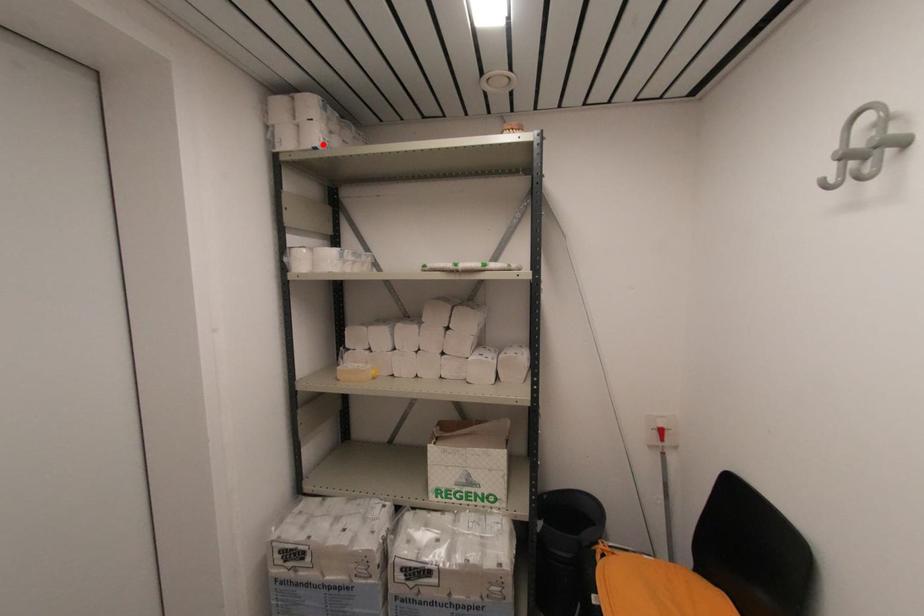
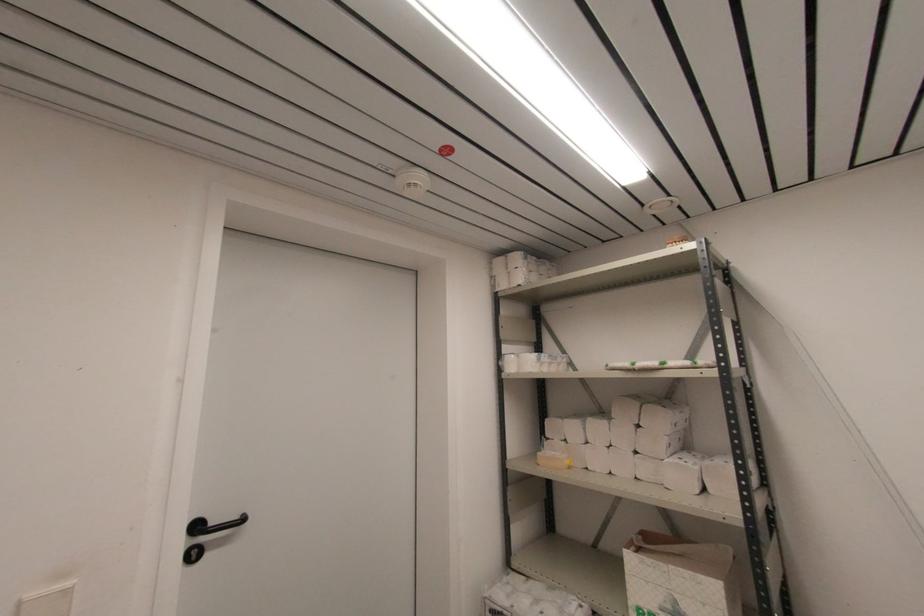
In the second image, find the point that corresponds to the highlighted location in the first image.

(524, 282)